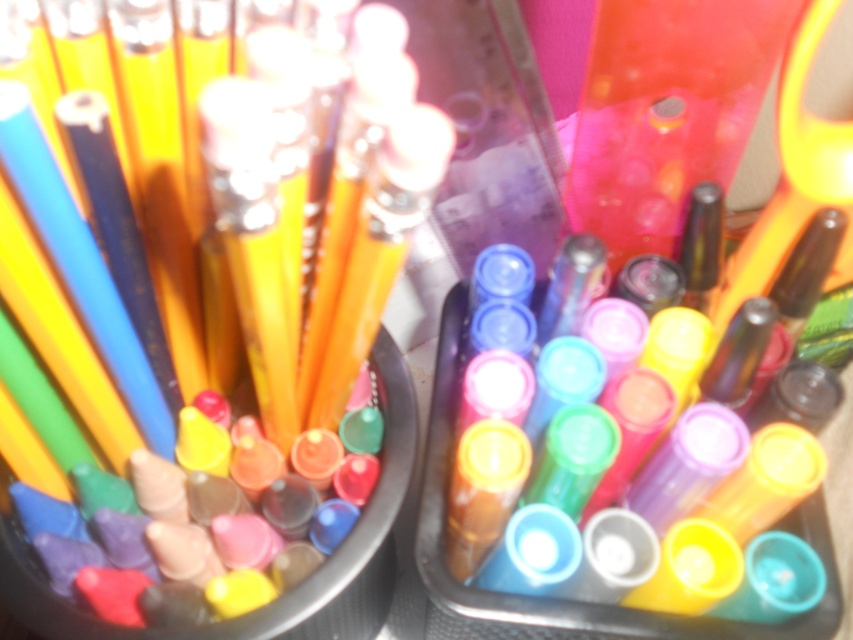
Does yellow plastic scissors at upper right appear on the right side of translucent plastic markers at center?

Yes, yellow plastic scissors at upper right is to the right of translucent plastic markers at center.

Is point (721, 300) more distant than point (520, 612)?

Yes, it is behind point (520, 612).

At what (x,y) coordinates should I click in order to perform the action: click on yellow plastic scissors at upper right. Please return your answer as a coordinate pair (x, y). The width and height of the screenshot is (853, 640). Looking at the image, I should click on (796, 177).

Is yellow plastic scissors at upper right further to camera compared to matte yellow pencil at center?

That is True.

Consider the image. Who is taller, yellow plastic scissors at upper right or matte yellow pencil at center?

Standing taller between the two is matte yellow pencil at center.

Locate an element on the screen. This screenshot has width=853, height=640. yellow plastic scissors at upper right is located at coordinates (796, 177).

Between matte yellow pencil at center and translucent plastic markers at center, which one appears on the right side from the viewer's perspective?

translucent plastic markers at center

At what (x,y) coordinates should I click in order to perform the action: click on matte yellow pencil at center. Please return your answer as a coordinate pair (x, y). This screenshot has height=640, width=853. Looking at the image, I should click on (416, 323).